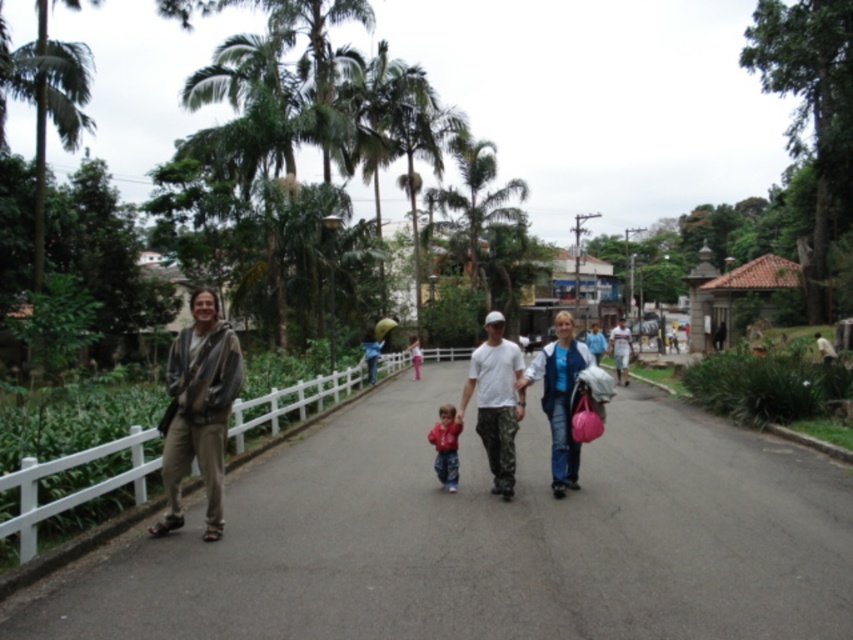
Question: Which of the following is the closest to the observer?

Choices:
 (A) asphalt road at center
 (B) white cotton shirt at center
 (C) camouflage pants at center

Answer: (A)

Question: Which object is farther from the camera taking this photo?

Choices:
 (A) white matte t-shirt at center
 (B) red fleece jacket at center
 (C) green leafy palm tree at center
 (D) brown textured jacket at left

Answer: (C)

Question: Does brown textured jacket at left appear on the right side of red fleece jacket at center?

Choices:
 (A) yes
 (B) no

Answer: (B)

Question: Does asphalt road at center have a lesser width compared to camouflage pants at center?

Choices:
 (A) yes
 (B) no

Answer: (B)

Question: Which point is closer to the camera taking this photo?

Choices:
 (A) (450, 488)
 (B) (506, 472)
 (C) (209, 481)

Answer: (C)

Question: Does brown textured jacket at left appear on the right side of red fleece jacket at center?

Choices:
 (A) yes
 (B) no

Answer: (B)